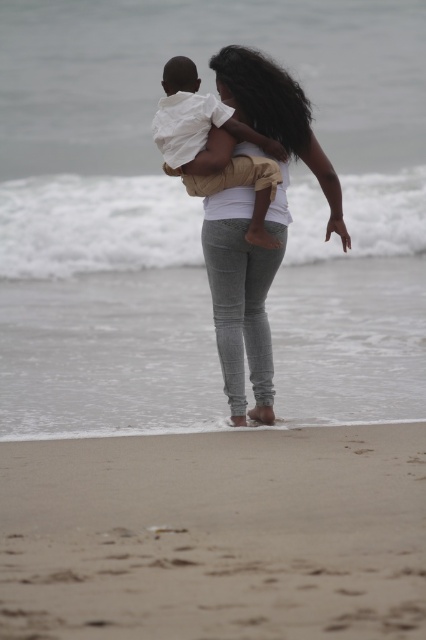
You are a photographer trying to capture the entire sandy beach at lower center and the gray textured pants at center in one shot. Which object should you focus on first to ensure both are in frame?

The sandy beach at lower center is bigger than the gray textured pants at center, so you should focus on the sandy beach at lower center first to ensure both fit in the frame.

You are a photographer trying to capture the scene of two people on the beach. You notice the gray textured pants at center. Where exactly should you focus your camera to ensure the pants are in sharp focus?

To ensure the gray textured pants at center are in sharp focus, you should focus your camera at point coordinates (242, 296).